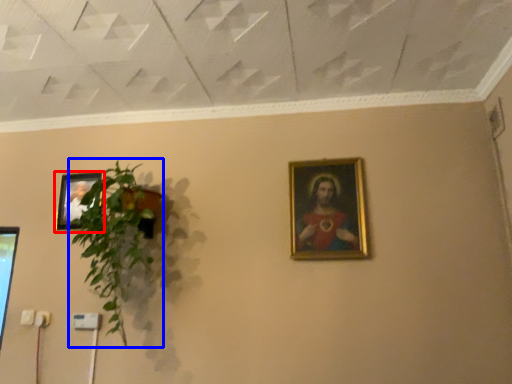
Question: Which of the following is the closest to the observer, picture frame (highlighted by a red box) or houseplant (highlighted by a blue box)?

Choices:
 (A) picture frame
 (B) houseplant

Answer: (B)